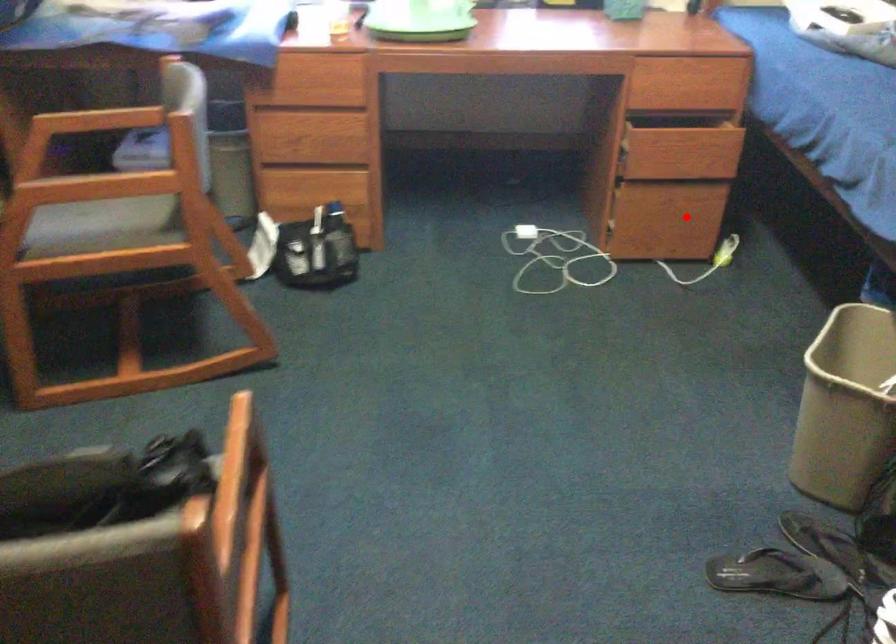
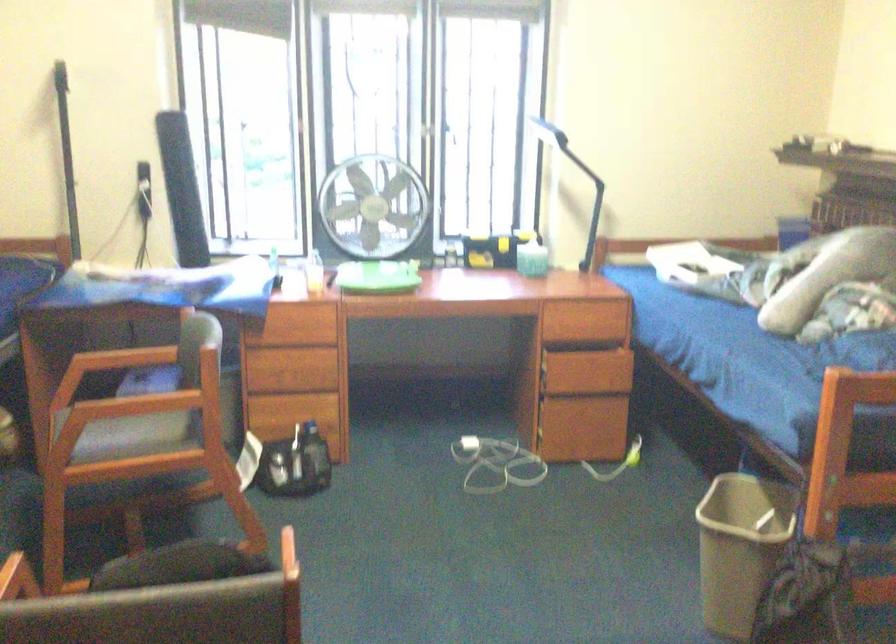
Where in the second image is the point corresponding to the highlighted location from the first image?

(599, 424)